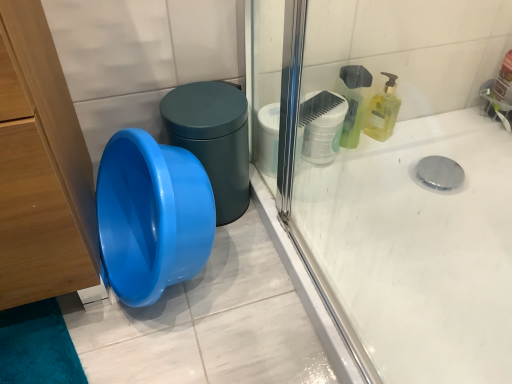
Locate an element on the screen. silver metallic faucet at upper right is located at coordinates (497, 107).

From the image's perspective, does yellow translucent liquid soap at upper right appear lower than silver metallic faucet at upper right?

Yes, from the image's perspective, yellow translucent liquid soap at upper right is beneath silver metallic faucet at upper right.

Who is bigger, yellow translucent liquid soap at upper right or silver metallic faucet at upper right?

With larger size is silver metallic faucet at upper right.

Is yellow translucent liquid soap at upper right surrounding silver metallic faucet at upper right?

No, silver metallic faucet at upper right is not inside yellow translucent liquid soap at upper right.

Can you confirm if yellow translucent liquid soap at upper right is shorter than silver metallic faucet at upper right?

No, yellow translucent liquid soap at upper right is not shorter than silver metallic faucet at upper right.

Where is `cleaning product behind the blue glossy potty at center left`? This screenshot has height=384, width=512. cleaning product behind the blue glossy potty at center left is located at coordinates (383, 111).

From the image's perspective, is yellow translucent liquid soap at upper right located beneath blue glossy potty at center left?

No.

Is yellow translucent liquid soap at upper right shorter than blue glossy potty at center left?

Yes, yellow translucent liquid soap at upper right is shorter than blue glossy potty at center left.

Is yellow translucent liquid soap at upper right bigger than blue glossy potty at center left?

Actually, yellow translucent liquid soap at upper right might be smaller than blue glossy potty at center left.

From the image's perspective, is white matte toilet paper at upper right on yellow translucent liquid soap at upper right?

Actually, white matte toilet paper at upper right appears below yellow translucent liquid soap at upper right in the image.

Considering the sizes of objects white matte toilet paper at upper right and yellow translucent liquid soap at upper right in the image provided, who is smaller, white matte toilet paper at upper right or yellow translucent liquid soap at upper right?

yellow translucent liquid soap at upper right is smaller.

Is white matte toilet paper at upper right next to yellow translucent liquid soap at upper right?

No, white matte toilet paper at upper right is not with yellow translucent liquid soap at upper right.

How many degrees apart are the facing directions of white matte toilet paper at upper right and yellow translucent liquid soap at upper right?

0.0982 degrees separate the facing orientations of white matte toilet paper at upper right and yellow translucent liquid soap at upper right.

Is point (240, 182) behind point (389, 100)?

No, (240, 182) is in front of (389, 100).

Is blue glossy potty at center left looking in the opposite direction of yellow translucent liquid soap at upper right?

That's not correct — blue glossy potty at center left is not looking away from yellow translucent liquid soap at upper right.

Find the location of a particular element. Image resolution: width=512 pixels, height=384 pixels. potty located below the yellow translucent liquid soap at upper right (from the image's perspective) is located at coordinates (213, 139).

From a real-world perspective, is blue glossy potty at center left positioned above or below white matte toilet paper at upper right?

From a real-world perspective, blue glossy potty at center left is physically above white matte toilet paper at upper right.

Considering the relative positions of blue glossy potty at center left and white matte toilet paper at upper right in the image provided, is blue glossy potty at center left behind white matte toilet paper at upper right?

No, the depth of blue glossy potty at center left is less than that of white matte toilet paper at upper right.

Is blue glossy potty at center left positioned far away from white matte toilet paper at upper right?

Actually, blue glossy potty at center left and white matte toilet paper at upper right are a little close together.

In the scene shown: Between blue glossy potty at center left and white matte toilet paper at upper right, which one has smaller width?

white matte toilet paper at upper right is thinner.

Looking at this image, relative to silver metallic faucet at upper right, is blue glossy potty at center left in front or behind?

blue glossy potty at center left is in front of silver metallic faucet at upper right.

Is blue glossy potty at center left facing towards silver metallic faucet at upper right?

No, blue glossy potty at center left is not facing towards silver metallic faucet at upper right.

Considering the sizes of objects blue glossy potty at center left and silver metallic faucet at upper right in the image provided, who is smaller, blue glossy potty at center left or silver metallic faucet at upper right?

silver metallic faucet at upper right.

From a real-world perspective, who is located lower, silver metallic faucet at upper right or yellow translucent liquid soap at upper right?

In real-world perspective, silver metallic faucet at upper right is lower.

Which object is further away from the camera taking this photo, silver metallic faucet at upper right or yellow translucent liquid soap at upper right?

Positioned behind is silver metallic faucet at upper right.

Does point (505, 117) appear closer or farther from the camera than point (376, 103)?

Point (505, 117).

Identify the location of cleaning product that appears below the silver metallic faucet at upper right (from the image's perspective). (383, 111).

There is a yellow translucent liquid soap at upper right. Identify the location of potty above it (from a real-world perspective). This screenshot has height=384, width=512. (213, 139).

Which object lies nearer to the anchor point blue glossy potty at center left, white matte toilet paper at upper right or silver metallic faucet at upper right?

white matte toilet paper at upper right.

Estimate the real-world distances between objects in this image. Which object is further from white matte toilet paper at upper right, blue glossy potty at center left or silver metallic faucet at upper right?

silver metallic faucet at upper right is positioned further to the anchor white matte toilet paper at upper right.

Considering their positions, is yellow translucent liquid soap at upper right positioned closer to silver metallic faucet at upper right than blue glossy potty at center left?

yellow translucent liquid soap at upper right lies closer to silver metallic faucet at upper right than the other object.

Looking at the image, which one is located closer to yellow translucent liquid soap at upper right, white matte toilet paper at upper right or silver metallic faucet at upper right?

white matte toilet paper at upper right lies closer to yellow translucent liquid soap at upper right than the other object.

Looking at the image, which one is located closer to yellow translucent liquid soap at upper right, silver metallic faucet at upper right or white matte toilet paper at upper right?

white matte toilet paper at upper right is positioned closer to the anchor yellow translucent liquid soap at upper right.

When comparing their distances from silver metallic faucet at upper right, does white matte toilet paper at upper right or yellow translucent liquid soap at upper right seem closer?

Based on the image, yellow translucent liquid soap at upper right appears to be nearer to silver metallic faucet at upper right.

Based on their spatial positions, is silver metallic faucet at upper right or white matte toilet paper at upper right closer to blue glossy potty at center left?

white matte toilet paper at upper right is closer to blue glossy potty at center left.

When comparing their distances from white matte toilet paper at upper right, does blue glossy potty at center left or yellow translucent liquid soap at upper right seem further?

blue glossy potty at center left lies further to white matte toilet paper at upper right than the other object.

Where is `toilet paper between blue glossy potty at center left and silver metallic faucet at upper right from left to right`? Image resolution: width=512 pixels, height=384 pixels. toilet paper between blue glossy potty at center left and silver metallic faucet at upper right from left to right is located at coordinates (322, 128).

Locate an element on the screen. The height and width of the screenshot is (384, 512). toilet paper located between blue glossy potty at center left and yellow translucent liquid soap at upper right in the left-right direction is located at coordinates (322, 128).

At what (x,y) coordinates should I click in order to perform the action: click on cleaning product located between white matte toilet paper at upper right and silver metallic faucet at upper right in the left-right direction. Please return your answer as a coordinate pair (x, y). The image size is (512, 384). Looking at the image, I should click on (383, 111).

This screenshot has width=512, height=384. In order to click on cleaning product between blue glossy potty at center left and silver metallic faucet at upper right in the horizontal direction in this screenshot , I will do `click(383, 111)`.